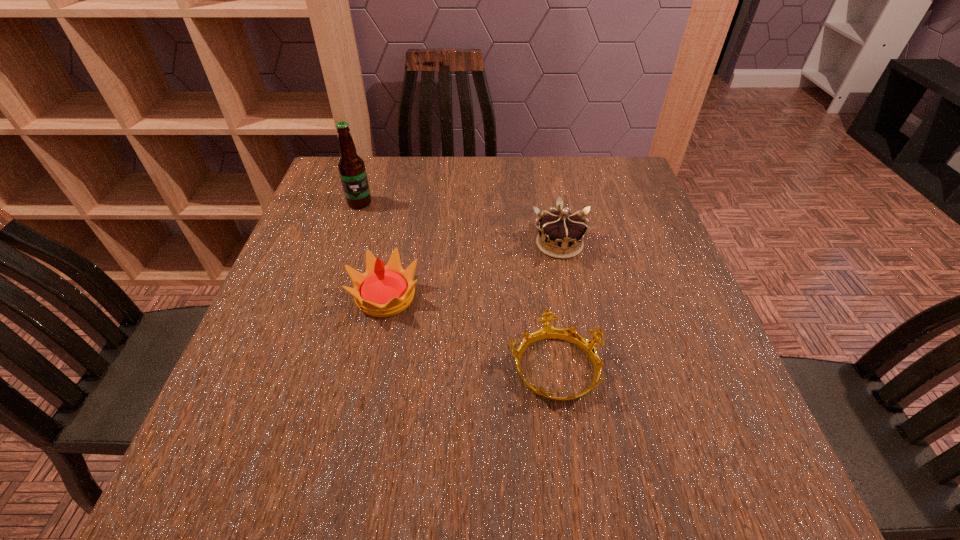
At what (x,y) coordinates should I click in order to perform the action: click on free space that is in between the beer bottle and the leftmost crown. Please return your answer as a coordinate pair (x, y). This screenshot has width=960, height=540. Looking at the image, I should click on (372, 249).

The height and width of the screenshot is (540, 960). I want to click on unoccupied area between the second farthest object and the nearest crown, so click(x=557, y=306).

Where is `vacant area that lies between the second farthest object and the leftmost object`? The height and width of the screenshot is (540, 960). vacant area that lies between the second farthest object and the leftmost object is located at coordinates (460, 224).

Locate an element on the screen. The image size is (960, 540). free space between the farthest crown and the farthest object is located at coordinates (460, 224).

You are a GUI agent. You are given a task and a screenshot of the screen. Output one action in this format:
    pyautogui.click(x=<x>, y=<y>)
    Task: Click on the blank region between the farthest crown and the tallest object
    
    Given the screenshot: What is the action you would take?
    pyautogui.click(x=460, y=224)

This screenshot has height=540, width=960. I want to click on free area in between the second farthest object and the nearest object, so click(557, 306).

Locate an element on the screen. The width and height of the screenshot is (960, 540). vacant space that is in between the farthest object and the second farthest object is located at coordinates (460, 224).

What are the coordinates of `free space between the third nearest object and the nearest object` in the screenshot? It's located at (557, 306).

Find the location of a particular element. Image resolution: width=960 pixels, height=540 pixels. vacant space that's between the third nearest object and the second nearest object is located at coordinates (472, 270).

Select which object is the third closest to the farthest crown. Please provide its 2D coordinates. Your answer should be formatted as a tuple, i.e. [(x, y)], where the tuple contains the x and y coordinates of a point satisfying the conditions above.

[(351, 167)]